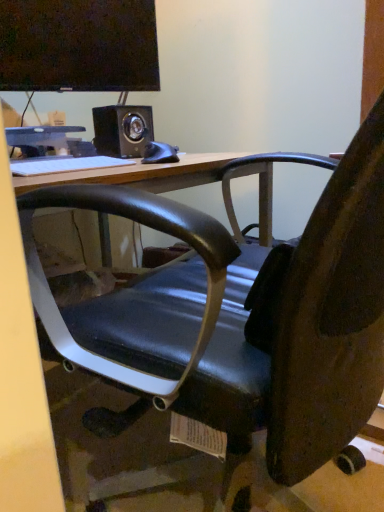
Question: Does black matte mouse at center have a larger size compared to matte black monitor at upper left?

Choices:
 (A) no
 (B) yes

Answer: (A)

Question: From the image's perspective, is black matte mouse at center over matte black monitor at upper left?

Choices:
 (A) no
 (B) yes

Answer: (A)

Question: Considering the relative positions of black matte mouse at center and matte black monitor at upper left in the image provided, is black matte mouse at center to the left of matte black monitor at upper left from the viewer's perspective?

Choices:
 (A) yes
 (B) no

Answer: (B)

Question: Considering the relative positions of black matte mouse at center and matte black monitor at upper left in the image provided, is black matte mouse at center to the right of matte black monitor at upper left from the viewer's perspective?

Choices:
 (A) no
 (B) yes

Answer: (B)

Question: Could you tell me if black matte mouse at center is turned towards matte black monitor at upper left?

Choices:
 (A) yes
 (B) no

Answer: (B)

Question: From the image's perspective, is black matte mouse at center below matte black monitor at upper left?

Choices:
 (A) yes
 (B) no

Answer: (A)

Question: Is white matte keyboard at upper center closer to the viewer compared to black matte mouse at center?

Choices:
 (A) no
 (B) yes

Answer: (B)

Question: From the image's perspective, is white matte keyboard at upper center beneath black matte mouse at center?

Choices:
 (A) yes
 (B) no

Answer: (A)

Question: Is white matte keyboard at upper center located outside black matte mouse at center?

Choices:
 (A) yes
 (B) no

Answer: (A)

Question: From a real-world perspective, is white matte keyboard at upper center on top of black matte mouse at center?

Choices:
 (A) no
 (B) yes

Answer: (A)

Question: Considering the relative sizes of white matte keyboard at upper center and black matte mouse at center in the image provided, is white matte keyboard at upper center thinner than black matte mouse at center?

Choices:
 (A) yes
 (B) no

Answer: (B)

Question: Can you confirm if white matte keyboard at upper center is smaller than black matte mouse at center?

Choices:
 (A) yes
 (B) no

Answer: (B)

Question: Considering the relative sizes of black matte mouse at center and white matte keyboard at upper center in the image provided, is black matte mouse at center shorter than white matte keyboard at upper center?

Choices:
 (A) yes
 (B) no

Answer: (B)